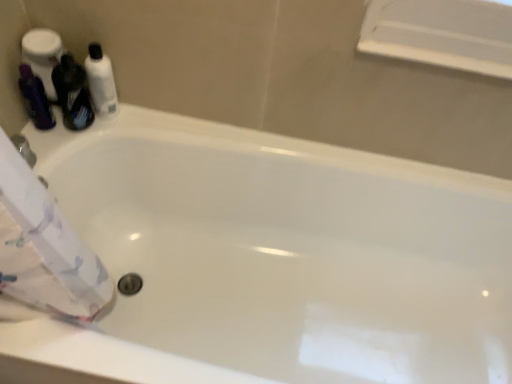
Question: Considering the relative sizes of white glossy bottle at upper left, positioned as the first toiletry in right-to-left order, and matte purple shampoo at left, which appears as the second toiletry when viewed from the right, in the image provided, is white glossy bottle at upper left, positioned as the first toiletry in right-to-left order, taller than matte purple shampoo at left, which appears as the second toiletry when viewed from the right,?

Choices:
 (A) yes
 (B) no

Answer: (A)

Question: From a real-world perspective, is white glossy bottle at upper left, positioned as the first toiletry in right-to-left order, physically below matte purple shampoo at left, which appears as the second toiletry when viewed from the right?

Choices:
 (A) no
 (B) yes

Answer: (A)

Question: Is the position of white glossy bottle at upper left, which is the 2th toiletry from left to right, more distant than that of matte purple shampoo at left, which appears as the second toiletry when viewed from the right?

Choices:
 (A) yes
 (B) no

Answer: (A)

Question: Is white glossy bottle at upper left, which is the 2th toiletry from left to right, to the left of matte purple shampoo at left, which is the 1th toiletry in left-to-right order, from the viewer's perspective?

Choices:
 (A) no
 (B) yes

Answer: (A)

Question: Can you confirm if white glossy bottle at upper left, which is the 2th toiletry from left to right, is shorter than matte purple shampoo at left, which appears as the second toiletry when viewed from the right?

Choices:
 (A) no
 (B) yes

Answer: (A)

Question: Relative to matte purple shampoo at left, which appears as the second toiletry when viewed from the right, is matte black bottle at left in front or behind?

Choices:
 (A) front
 (B) behind

Answer: (A)

Question: Considering the positions of matte black bottle at left and matte purple shampoo at left, which appears as the second toiletry when viewed from the right, in the image, is matte black bottle at left bigger or smaller than matte purple shampoo at left, which appears as the second toiletry when viewed from the right,?

Choices:
 (A) small
 (B) big

Answer: (B)

Question: Visually, is matte black bottle at left positioned to the left or to the right of matte purple shampoo at left, which is the 1th toiletry in left-to-right order?

Choices:
 (A) right
 (B) left

Answer: (A)

Question: Choose the correct answer: Is matte black bottle at left inside matte purple shampoo at left, which is the 1th toiletry in left-to-right order, or outside it?

Choices:
 (A) inside
 (B) outside

Answer: (B)

Question: Choose the correct answer: Is white glossy bottle at upper left, which is the 2th toiletry from left to right, inside matte black bottle at left or outside it?

Choices:
 (A) inside
 (B) outside

Answer: (B)

Question: Based on their sizes in the image, would you say white glossy bottle at upper left, which is the 2th toiletry from left to right, is bigger or smaller than matte black bottle at left?

Choices:
 (A) small
 (B) big

Answer: (A)

Question: From the image's perspective, is white glossy bottle at upper left, which is the 2th toiletry from left to right, positioned above or below matte black bottle at left?

Choices:
 (A) below
 (B) above

Answer: (B)

Question: Is white glossy bottle at upper left, which is the 2th toiletry from left to right, taller or shorter than matte black bottle at left?

Choices:
 (A) short
 (B) tall

Answer: (A)

Question: Based on their positions, is white glossy bottle at upper left, positioned as the first toiletry in right-to-left order, located to the left or right of matte purple shampoo at left, which is the 1th toiletry in left-to-right order?

Choices:
 (A) left
 (B) right

Answer: (B)

Question: Considering the positions of white glossy bottle at upper left, positioned as the first toiletry in right-to-left order, and matte purple shampoo at left, which is the 1th toiletry in left-to-right order, in the image, is white glossy bottle at upper left, positioned as the first toiletry in right-to-left order, wider or thinner than matte purple shampoo at left, which is the 1th toiletry in left-to-right order,?

Choices:
 (A) wide
 (B) thin

Answer: (A)